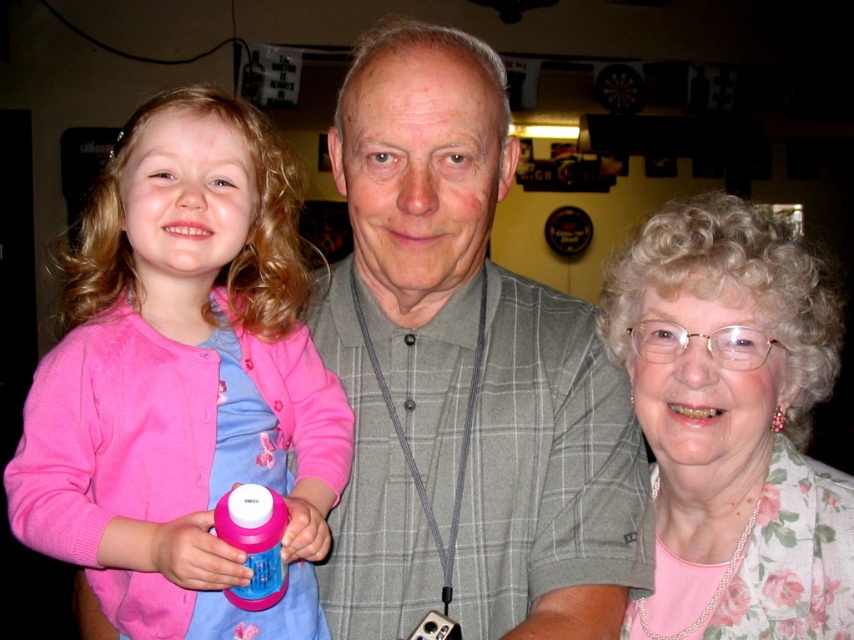
Question: Can you confirm if pink fleece sweater at left is positioned to the left of floral-patterned blouse at right?

Choices:
 (A) yes
 (B) no

Answer: (A)

Question: Can you confirm if gray plaid shirt at center is bigger than floral-patterned blouse at right?

Choices:
 (A) no
 (B) yes

Answer: (B)

Question: Which of the following is the farthest from the observer?

Choices:
 (A) (126, 280)
 (B) (478, 388)

Answer: (B)

Question: Is pink fleece sweater at left smaller than floral-patterned blouse at right?

Choices:
 (A) no
 (B) yes

Answer: (A)

Question: Estimate the real-world distances between objects in this image. Which object is farther from the pink fleece sweater at left?

Choices:
 (A) gray plaid shirt at center
 (B) floral-patterned blouse at right

Answer: (B)

Question: Which of the following is the closest to the observer?

Choices:
 (A) gray plaid shirt at center
 (B) floral-patterned blouse at right

Answer: (A)